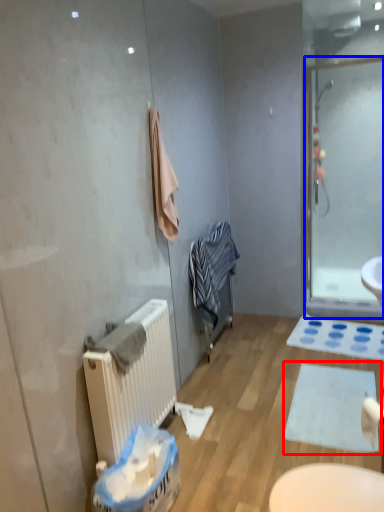
Question: Which object appears farthest to the camera in this image, bath mat (highlighted by a red box) or screen door (highlighted by a blue box)?

Choices:
 (A) bath mat
 (B) screen door

Answer: (B)